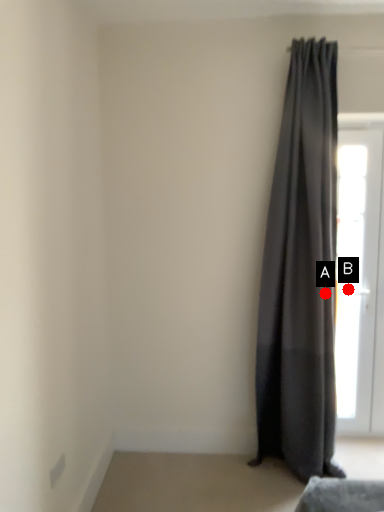
Question: Two points are circled on the image, labeled by A and B beside each circle. Which point is farther from the camera taking this photo?

Choices:
 (A) A is further
 (B) B is further

Answer: (B)